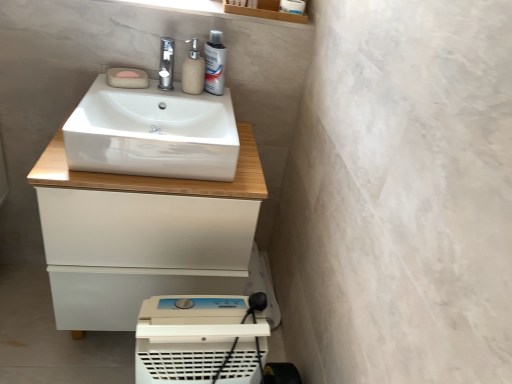
Question: Based on their positions, is white glossy sink at center located to the left or right of silver metallic mouthwash at upper center?

Choices:
 (A) left
 (B) right

Answer: (A)

Question: In terms of width, does white glossy sink at center look wider or thinner when compared to silver metallic mouthwash at upper center?

Choices:
 (A) thin
 (B) wide

Answer: (B)

Question: Estimate the real-world distances between objects in this image. Which object is closer to the satin nickel faucet at upper center?

Choices:
 (A) matte beige soap dispenser at upper center
 (B) white plastic air purifier at lower center
 (C) pink felt soap at upper left, which is the 2th soap in top-to-bottom order
 (D) white glossy cabinet at center
 (E) beige matte soap at upper left, which is the second soap in bottom-to-top order

Answer: (A)

Question: Estimate the real-world distances between objects in this image. Which object is closer to the beige matte soap at upper left, the first soap when ordered from top to bottom?

Choices:
 (A) matte beige soap dispenser at upper center
 (B) white glossy sink at center
 (C) pink felt soap at upper left, which is the 2th soap in top-to-bottom order
 (D) satin nickel faucet at upper center
 (E) silver metallic mouthwash at upper center

Answer: (C)